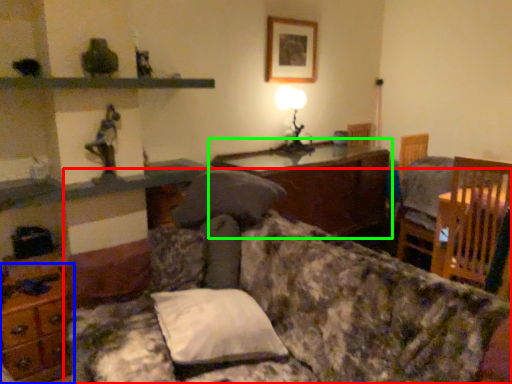
Question: Estimate the real-world distances between objects in this image. Which object is closer to studio couch (highlighted by a red box), dresser (highlighted by a blue box) or table (highlighted by a green box)?

Choices:
 (A) dresser
 (B) table

Answer: (A)